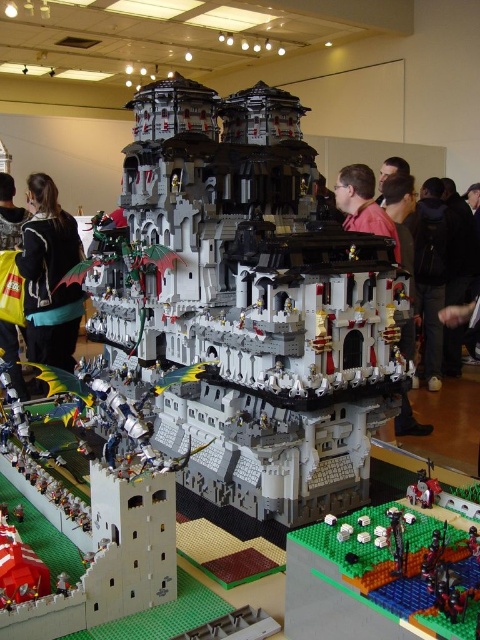
You are standing in front of a Lego display and see the white matte castle at center and the black fabric jacket at left. Which object is positioned to the left?

The black fabric jacket at left is positioned to the left.

You are a Lego enthusiast trying to fit a black fabric jacket at left into a display case that can only accommodate items narrower than the white matte castle at center. Can the jacket fit based on their widths?

The white matte castle at center might be wider than black fabric jacket at left, so the jacket could potentially fit in the display case if it is narrower. However, since the exact width difference isn not specified, it is uncertain. Please measure both items to confirm.

You are an attendee at the Lego exhibition and you want to take a photo of the white matte castle at center without the yellow fabric bag at lower left appearing in the frame. Which direction should you move your camera to the right or left?

You should move your camera to the left because the white matte castle at center is to the right of the yellow fabric bag at lower left. By moving the camera left, you can position the castle while excluding the bag from the frame.